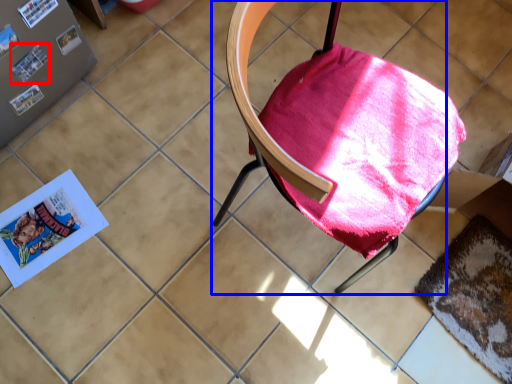
Question: Which object is closer to the camera taking this photo, paperback book (highlighted by a red box) or chair (highlighted by a blue box)?

Choices:
 (A) paperback book
 (B) chair

Answer: (B)